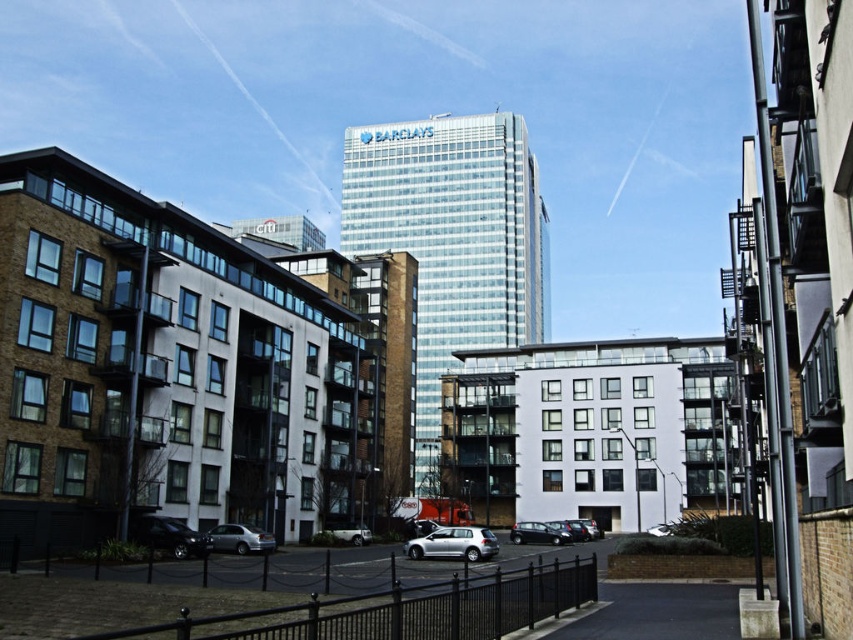
You are standing in the urban scene and want to move from the point at coordinates point (457, 556) to the point at coordinates point (231, 538). Which direction should you move to get closer to the camera?

To move closer to the camera, you should move towards point (457, 556) because it is closer to the camera than point (231, 538).

You are standing in front of the Barclays skyscraper and notice two points marked on the glass facade. The first point is at coordinates point (412, 552) and the second is at point (544, 538). Which point is nearer to your current position?

Point (412, 552) is closer to the camera than point (544, 538), so the first point is nearer to your current position.